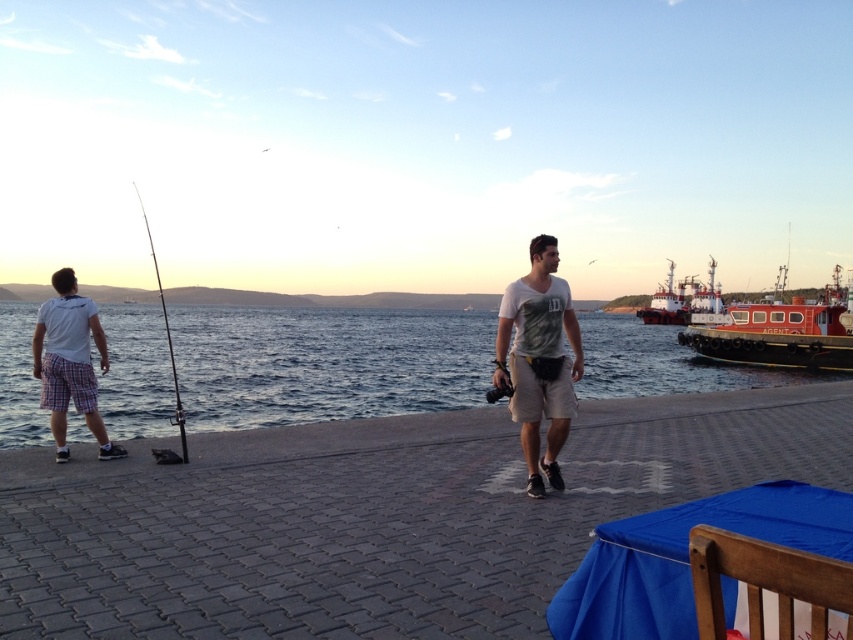
Question: Can you confirm if blue water at center is positioned above camouflage t-shirt at center?

Choices:
 (A) yes
 (B) no

Answer: (A)

Question: Which object appears farthest from the camera in this image?

Choices:
 (A) red matte tugboat at right
 (B) camouflage t-shirt at center
 (C) white cotton shirt at left
 (D) shiny metallic fishing pole at left

Answer: (A)

Question: Observing the image, what is the correct spatial positioning of white cotton shirt at left in reference to reddish-orange metal tugboat at right?

Choices:
 (A) left
 (B) right

Answer: (A)

Question: Which point is closer to the camera taking this photo?

Choices:
 (A) (520, 307)
 (B) (380, 339)
 (C) (712, 298)

Answer: (A)

Question: Can you confirm if white cotton shirt at left is thinner than shiny metallic fishing pole at left?

Choices:
 (A) no
 (B) yes

Answer: (B)

Question: Estimate the real-world distances between objects in this image. Which object is farther from the red matte tugboat at right?

Choices:
 (A) white cotton shirt at left
 (B) camouflage t-shirt at center
 (C) shiny metallic fishing pole at left
 (D) reddish-orange metal tugboat at right

Answer: (A)